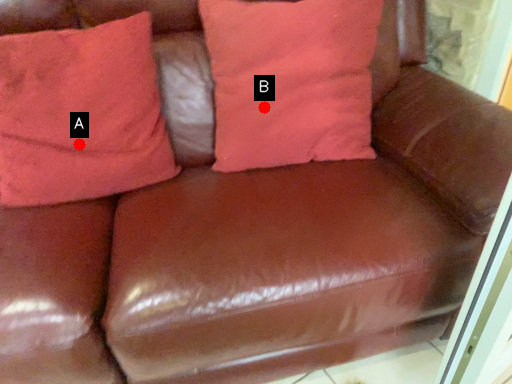
Question: Two points are circled on the image, labeled by A and B beside each circle. Which point is closer to the camera taking this photo?

Choices:
 (A) A is closer
 (B) B is closer

Answer: (A)